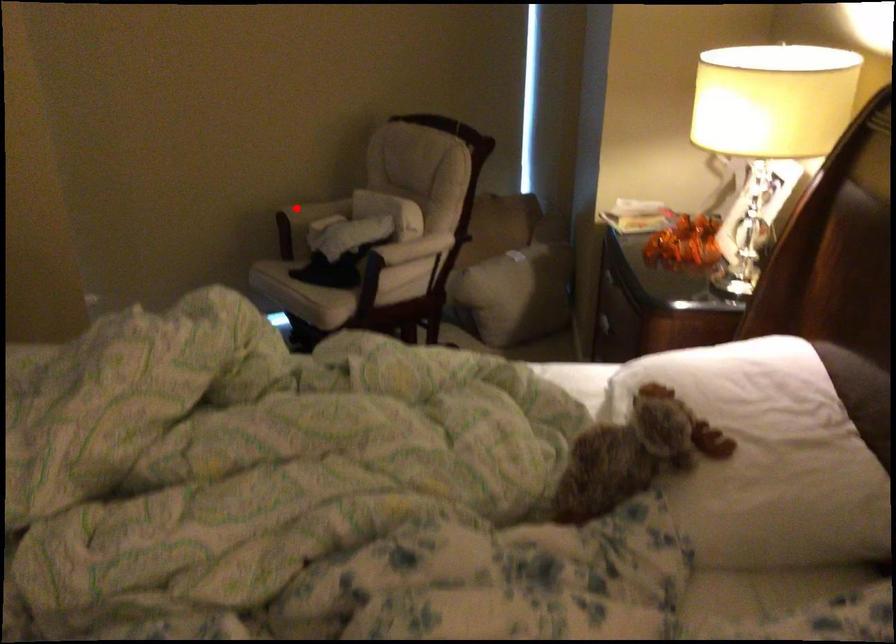
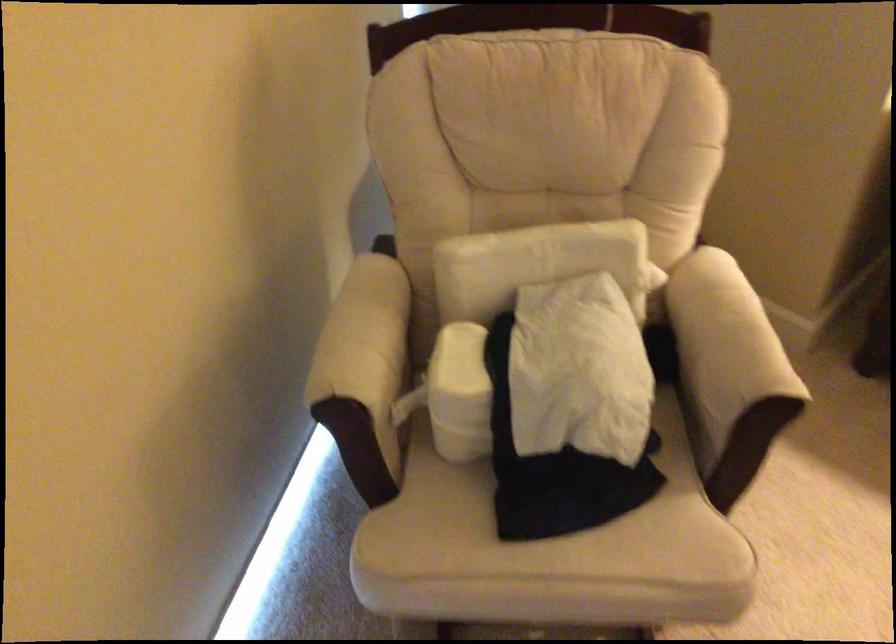
Question: A red point is marked in image1. In image2, is the corresponding 3D point closer to the camera or farther? Reply with the corresponding letter.

Choices:
 (A) The corresponding 3D point is closer.
 (B) The corresponding 3D point is farther.

Answer: (A)